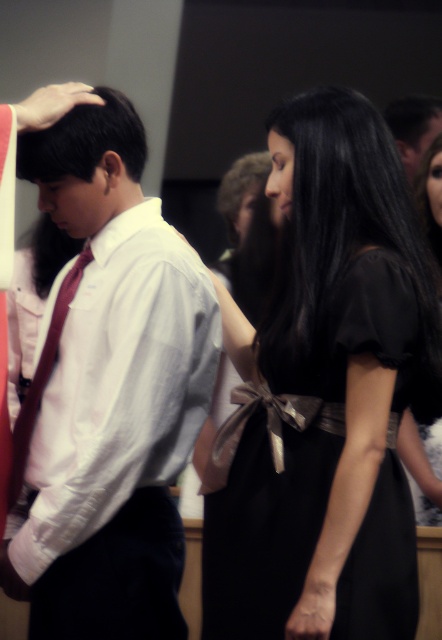
You are at a formal event and need to locate the shiny black dress at center and the matte red tie at center. Based on their positions, which one is lower in the image?

The shiny black dress at center is below matte red tie at center, so the shiny black dress at center is lower in the image.

You are a photographer at a formal event and need to capture a closeup shot of both the shiny black dress at center and the matte red tie at center. Given that your camera has a depth of field that can focus on objects within a 3.5 feet range, will both subjects be in focus?

The shiny black dress at center and the matte red tie at center are 3.90 feet apart. Since the distance between them exceeds the camera lens depth of field range of 3.5 feet, both subjects cannot be in focus simultaneously.

You are a photographer at a formal event. You need to position a spotlight exactly at the point marked by coordinates (324, 394). According to the image, which object will this spotlight illuminate?

The point marked by coordinates (324, 394) indicates the black satin dress at center, so the spotlight will illuminate the black satin dress at center.